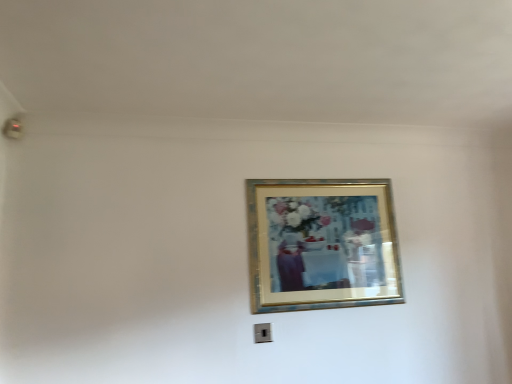
Question: Can you confirm if gold metallic picture frame at upper center is bigger than black plastic electric outlet at lower center?

Choices:
 (A) no
 (B) yes

Answer: (B)

Question: Considering the relative positions of gold metallic picture frame at upper center and black plastic electric outlet at lower center in the image provided, is gold metallic picture frame at upper center to the right of black plastic electric outlet at lower center from the viewer's perspective?

Choices:
 (A) no
 (B) yes

Answer: (B)

Question: Is gold metallic picture frame at upper center far from black plastic electric outlet at lower center?

Choices:
 (A) yes
 (B) no

Answer: (B)

Question: Is gold metallic picture frame at upper center turned away from black plastic electric outlet at lower center?

Choices:
 (A) no
 (B) yes

Answer: (A)

Question: Does gold metallic picture frame at upper center have a greater width compared to black plastic electric outlet at lower center?

Choices:
 (A) no
 (B) yes

Answer: (B)

Question: Can you confirm if gold metallic picture frame at upper center is taller than black plastic electric outlet at lower center?

Choices:
 (A) yes
 (B) no

Answer: (A)

Question: Can you confirm if black plastic electric outlet at lower center is smaller than gold metallic picture frame at upper center?

Choices:
 (A) yes
 (B) no

Answer: (A)

Question: Does black plastic electric outlet at lower center appear on the right side of gold metallic picture frame at upper center?

Choices:
 (A) no
 (B) yes

Answer: (A)

Question: From the image's perspective, does black plastic electric outlet at lower center appear lower than gold metallic picture frame at upper center?

Choices:
 (A) yes
 (B) no

Answer: (A)

Question: Does black plastic electric outlet at lower center contain gold metallic picture frame at upper center?

Choices:
 (A) no
 (B) yes

Answer: (A)

Question: Is black plastic electric outlet at lower center shorter than gold metallic picture frame at upper center?

Choices:
 (A) yes
 (B) no

Answer: (A)

Question: Does black plastic electric outlet at lower center have a greater height compared to gold metallic picture frame at upper center?

Choices:
 (A) yes
 (B) no

Answer: (B)

Question: In terms of height, does black plastic electric outlet at lower center look taller or shorter compared to gold metallic picture frame at upper center?

Choices:
 (A) tall
 (B) short

Answer: (B)